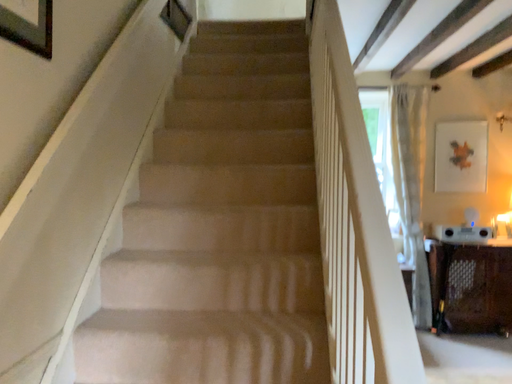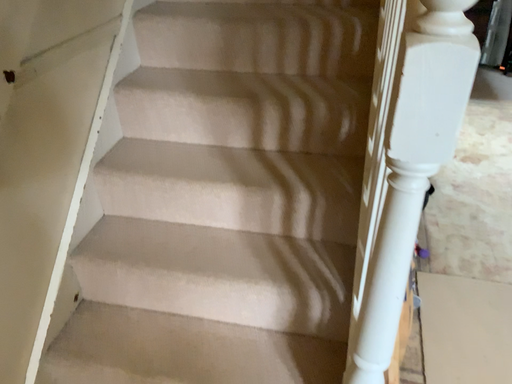
Question: Which way did the camera rotate in the video?

Choices:
 (A) rotated left
 (B) rotated right

Answer: (A)